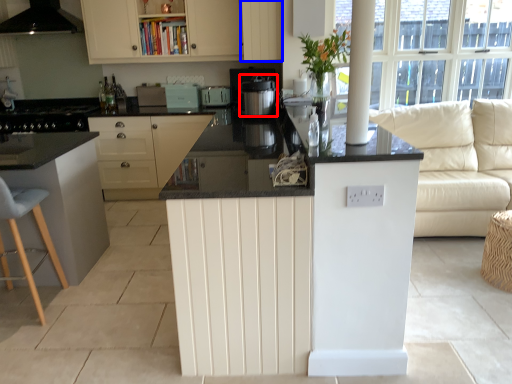
Question: Among these objects, which one is nearest to the camera, kitchen appliance (highlighted by a red box) or cabinetry (highlighted by a blue box)?

Choices:
 (A) kitchen appliance
 (B) cabinetry

Answer: (A)